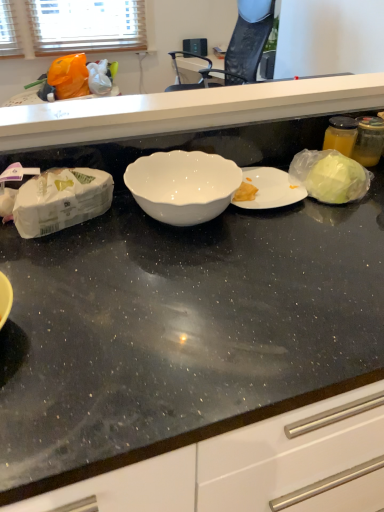
Question: Is white glossy bowl at center further to the viewer compared to white glossy countertop at center?

Choices:
 (A) yes
 (B) no

Answer: (B)

Question: Considering the relative sizes of white glossy bowl at center and white glossy countertop at center in the image provided, is white glossy bowl at center shorter than white glossy countertop at center?

Choices:
 (A) no
 (B) yes

Answer: (B)

Question: Is white glossy bowl at center not within white glossy countertop at center?

Choices:
 (A) no
 (B) yes

Answer: (B)

Question: From the image's perspective, is white glossy bowl at center beneath white glossy countertop at center?

Choices:
 (A) no
 (B) yes

Answer: (B)

Question: Is white glossy bowl at center thinner than white glossy countertop at center?

Choices:
 (A) yes
 (B) no

Answer: (B)

Question: Would you consider white glossy bowl at center to be distant from white glossy countertop at center?

Choices:
 (A) no
 (B) yes

Answer: (A)

Question: From a real-world perspective, is white glossy countertop at center beneath white glossy bowl at center?

Choices:
 (A) yes
 (B) no

Answer: (B)

Question: Is white glossy bowl at center surrounded by white glossy countertop at center?

Choices:
 (A) no
 (B) yes

Answer: (A)

Question: Is white glossy countertop at center to the left of white glossy bowl at center from the viewer's perspective?

Choices:
 (A) no
 (B) yes

Answer: (A)

Question: Is white glossy countertop at center in front of white glossy bowl at center?

Choices:
 (A) no
 (B) yes

Answer: (A)

Question: Is white glossy countertop at center thinner than white glossy bowl at center?

Choices:
 (A) yes
 (B) no

Answer: (A)

Question: Does white glossy countertop at center appear on the right side of white glossy bowl at center?

Choices:
 (A) yes
 (B) no

Answer: (A)

Question: From a real-world perspective, is white glossy bowl at center physically located above or below white glossy countertop at center?

Choices:
 (A) above
 (B) below

Answer: (B)